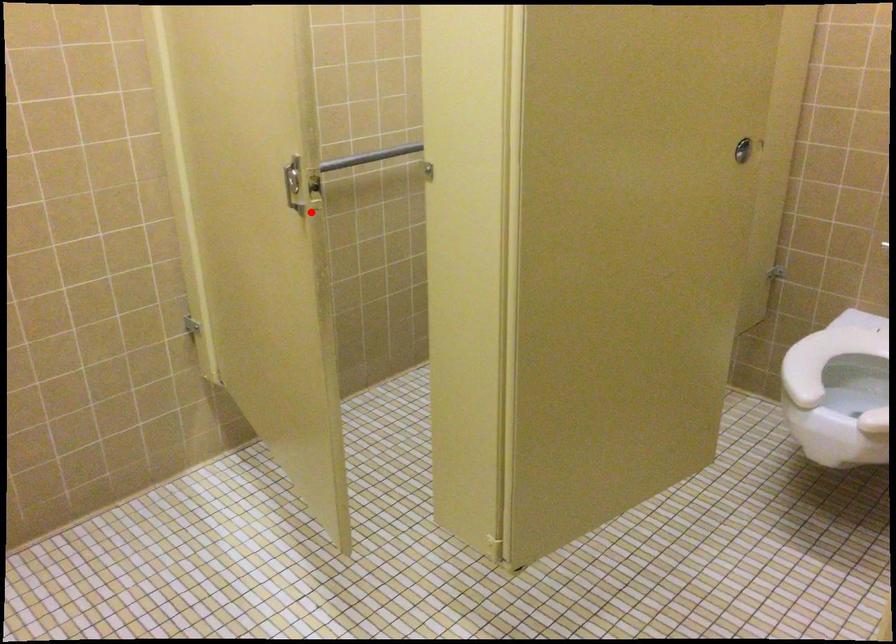
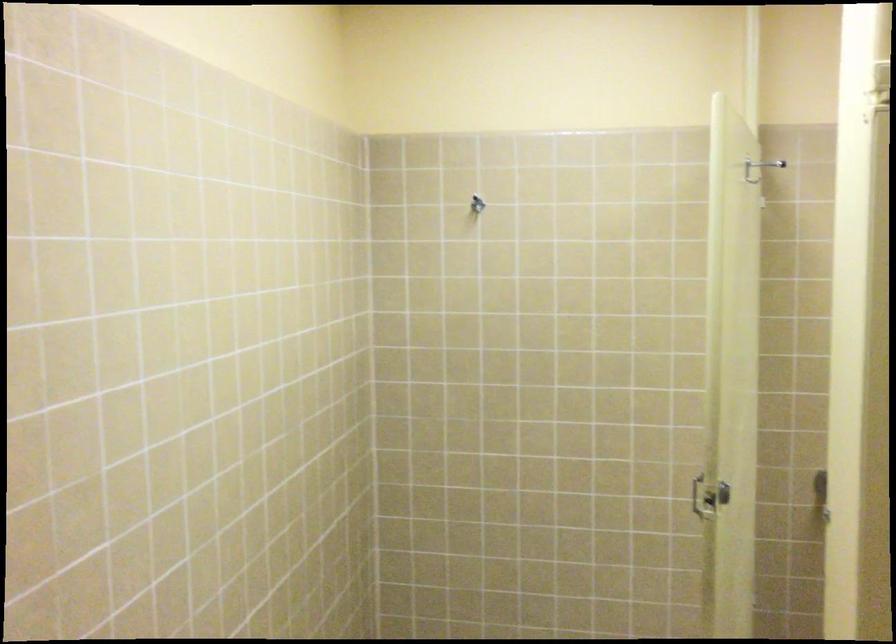
Locate, in the second image, the point that corresponds to the highlighted location in the first image.

(708, 497)